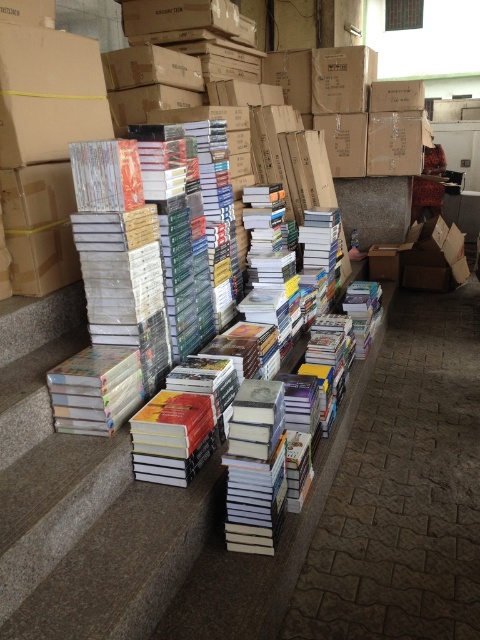
Does matte brown cardboard box at upper left come in front of brown cardboard box at center?

Yes, matte brown cardboard box at upper left is in front of brown cardboard box at center.

Measure the distance from matte brown cardboard box at upper left to brown cardboard box at center.

They are 8.90 feet apart.

The height and width of the screenshot is (640, 480). What do you see at coordinates (48, 93) in the screenshot?
I see `matte brown cardboard box at upper left` at bounding box center [48, 93].

The height and width of the screenshot is (640, 480). What are the coordinates of `matte brown cardboard box at upper left` in the screenshot? It's located at (48, 93).